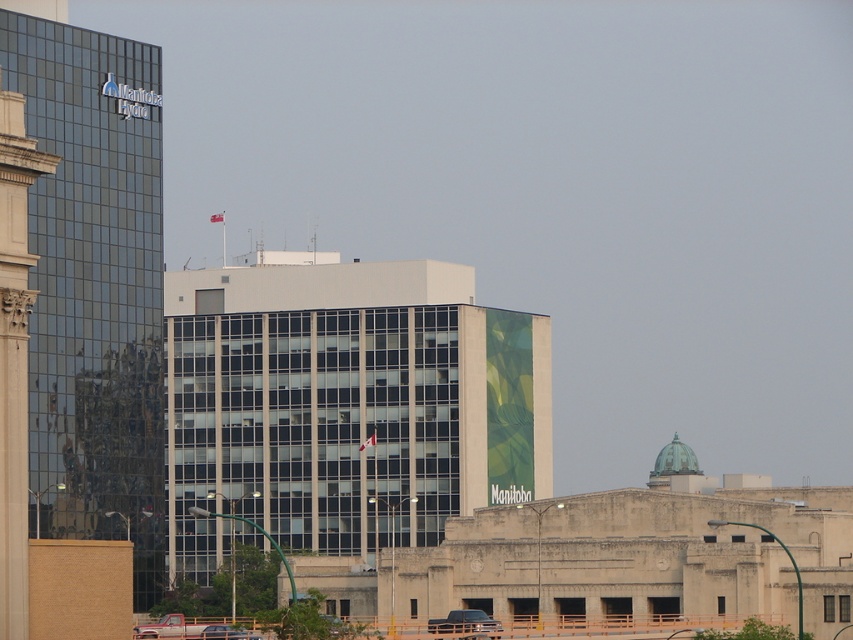
Question: Is matte black truck at center wider than metallic silver car at center?

Choices:
 (A) yes
 (B) no

Answer: (A)

Question: Which point is farther to the camera?

Choices:
 (A) metallic silver car at center
 (B) glassy reflective building at left
 (C) matte black truck at center

Answer: (A)

Question: Can you confirm if glassy reflective building at left is bigger than matte black truck at center?

Choices:
 (A) no
 (B) yes

Answer: (B)

Question: Which point is closer to the camera taking this photo?

Choices:
 (A) (457, 618)
 (B) (80, 516)
 (C) (218, 636)

Answer: (C)

Question: Which point is farther from the camera taking this photo?

Choices:
 (A) (451, 621)
 (B) (233, 627)

Answer: (B)

Question: Is the position of glassy reflective building at left more distant than that of matte black truck at center?

Choices:
 (A) no
 (B) yes

Answer: (A)